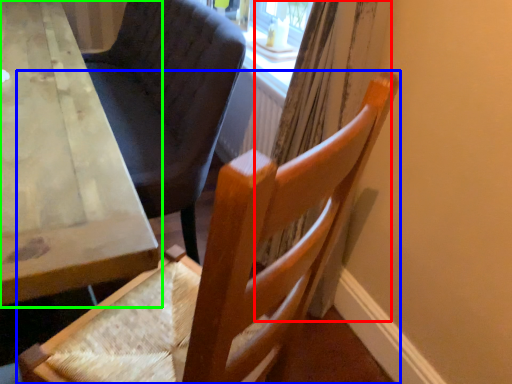
Question: Considering the real-world distances, which object is closest to curtain (highlighted by a red box)? chair (highlighted by a blue box) or table (highlighted by a green box).

Choices:
 (A) chair
 (B) table

Answer: (A)